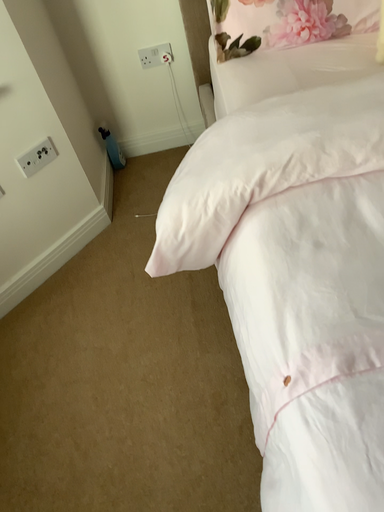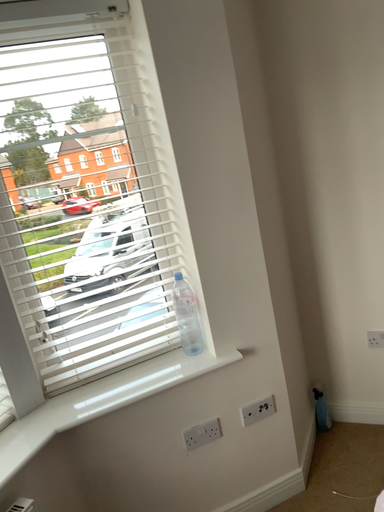
Question: Which way did the camera rotate in the video?

Choices:
 (A) rotated right
 (B) rotated left

Answer: (B)